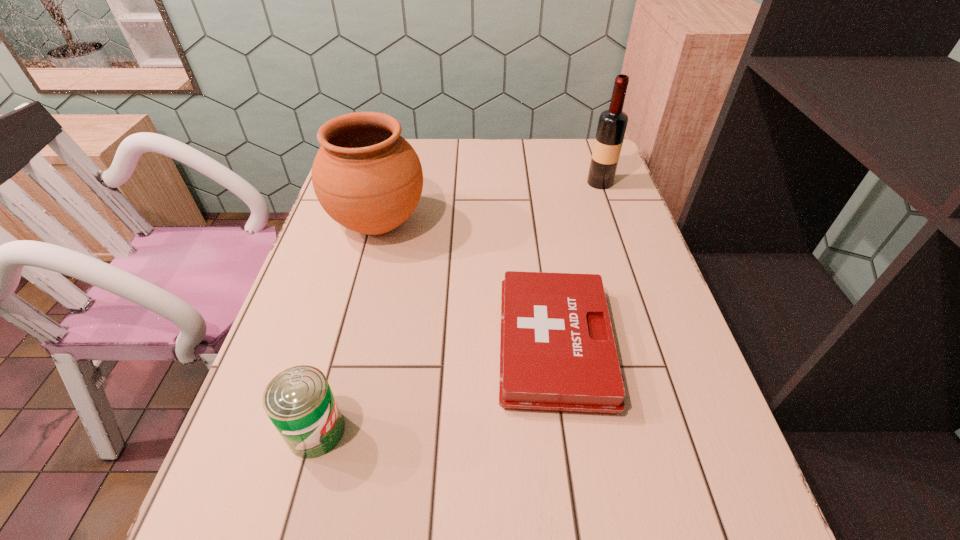
Find the location of a particular element. unoccupied area between the third shortest object and the third object from left to right is located at coordinates (467, 285).

You are a GUI agent. You are given a task and a screenshot of the screen. Output one action in this format:
    pyautogui.click(x=<x>, y=<y>)
    Task: Click on the object that stands as the closest to the third nearest object
    
    Given the screenshot: What is the action you would take?
    pyautogui.click(x=557, y=351)

I want to click on object that is the closest to the pottery, so click(x=557, y=351).

At what (x,y) coordinates should I click in order to perform the action: click on vacant space that satisfies the following two spatial constraints: 1. on the front side of the pottery; 2. on the left side of the shortest object. Please return your answer as a coordinate pair (x, y). This screenshot has width=960, height=540. Looking at the image, I should click on (347, 345).

This screenshot has width=960, height=540. What are the coordinates of `vacant position in the image that satisfies the following two spatial constraints: 1. on the back side of the wine bottle; 2. on the right side of the third nearest object` in the screenshot? It's located at (389, 183).

Image resolution: width=960 pixels, height=540 pixels. Identify the location of vacant space that satisfies the following two spatial constraints: 1. on the back side of the third tallest object; 2. on the right side of the farthest object. (385, 183).